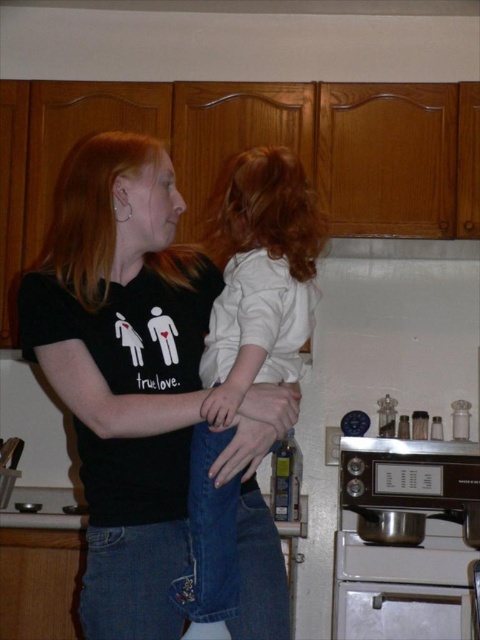
Question: Can you confirm if black matte t-shirt at center is wider than white soft shirt at center?

Choices:
 (A) yes
 (B) no

Answer: (A)

Question: Where is black matte t-shirt at center located in relation to white soft shirt at center in the image?

Choices:
 (A) above
 (B) below

Answer: (B)

Question: Is black matte t-shirt at center bigger than white soft shirt at center?

Choices:
 (A) no
 (B) yes

Answer: (B)